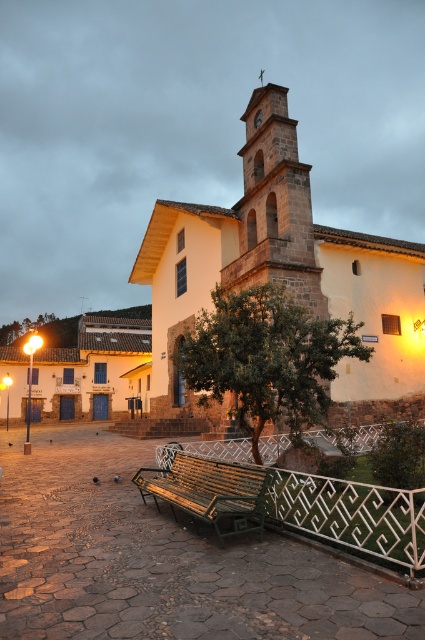
You are standing at the point marked as point (285,275) in the image. Based on the scene description, what structure are you directly facing?

The point (285,275) corresponds to the white stone church at center, so you are directly facing the white stone church at center.

You are an architect analyzing the church layout. Based on the scene, which object is positioned higher up in the image, the white stone church at center or the dark brown stone bell tower at center?

The dark brown stone bell tower at center is positioned higher up in the image than the white stone church at center, as the bell tower rises above the main church structure.